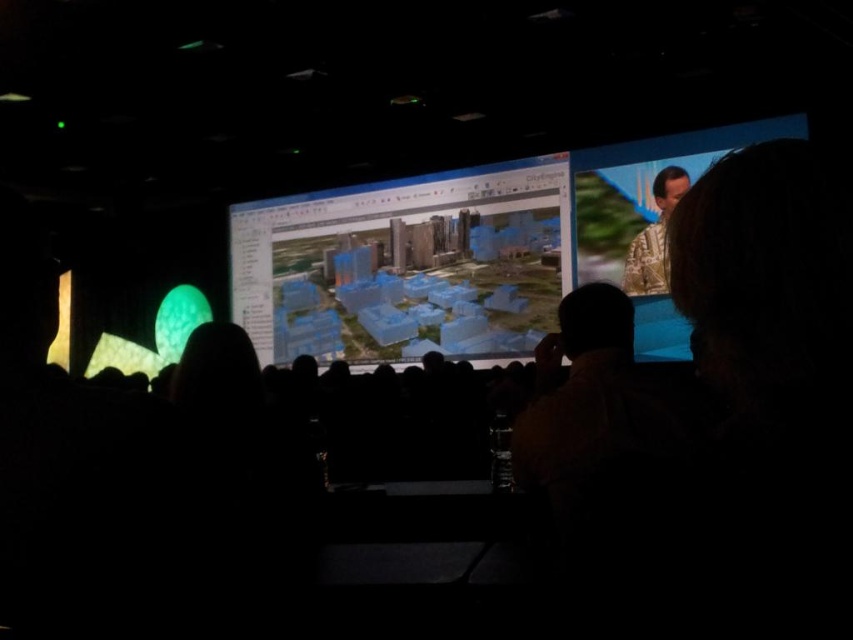
You are an attendee at the presentation and want to take a photo of the transparent blue model at center and camouflage fabric speaker at upper right. Which object will appear larger in your photo?

The transparent blue model at center will appear larger in your photo because it is closer to you than the camouflage fabric speaker at upper right.

You are attending a presentation and want to get a closer look at the transparent blue model at center. If you walk forward 10 feet, will you still be able to see the entire model in your view?

The transparent blue model at center is 30.83 feet away from viewer. After moving forward 10 feet, you will be 20.83 feet away. Since the model is still within your line of sight and not obstructed, you can still see the entire model.

You are a presenter standing at the front of the room. You need to walk from your current position to the transparent blue model at center and then to the patterned fabric shirt at upper right. Will you have to walk more than 3 meters in total?

The distance between the transparent blue model at center and the patterned fabric shirt at upper right is 3.48 meters. Since you first walk to the model and then to the shirt, the total distance would be more than 3 meters.